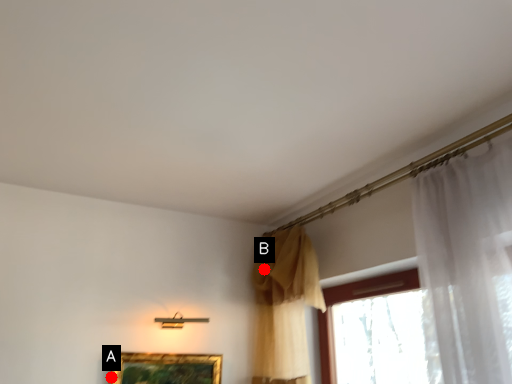
Question: Two points are circled on the image, labeled by A and B beside each circle. Among these points, which one is farthest from the camera?

Choices:
 (A) A is further
 (B) B is further

Answer: (B)